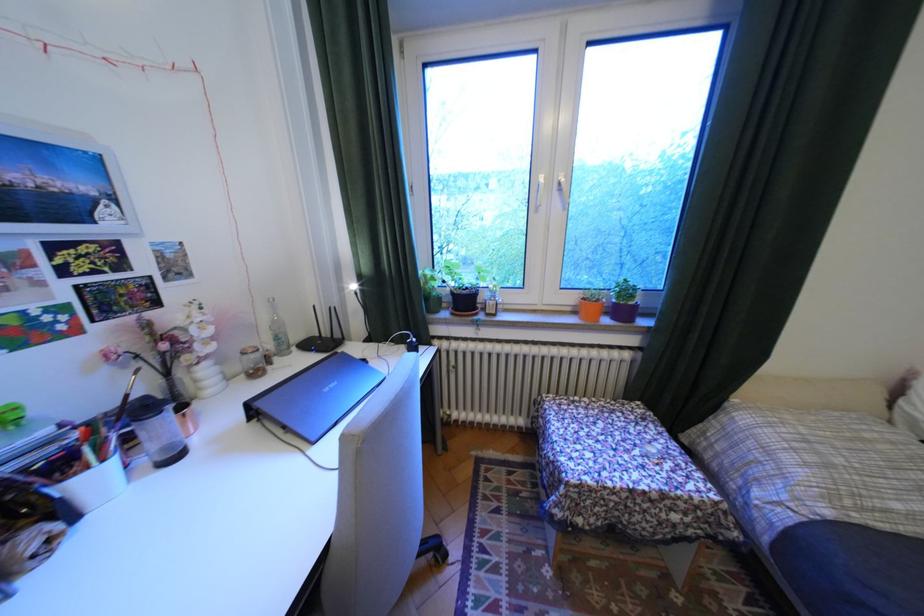
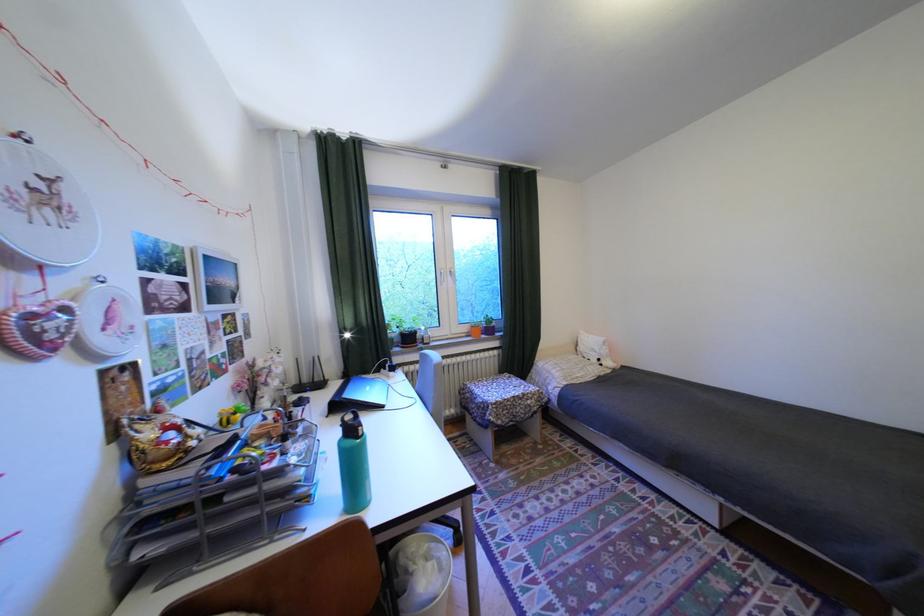
Locate, in the second image, the point that corresponds to point (344, 386) in the first image.

(380, 387)